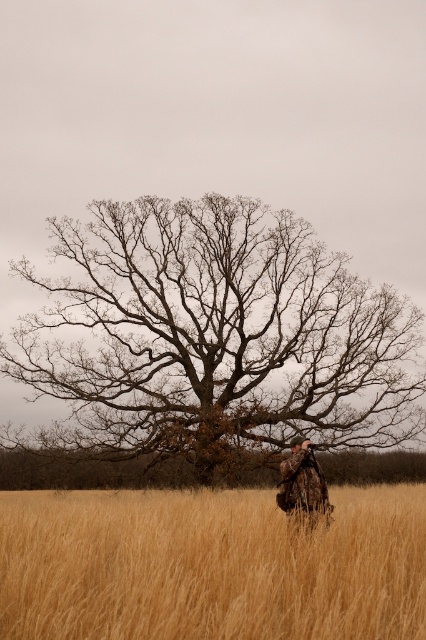
Question: Which of the following is the closest to the observer?

Choices:
 (A) (291, 509)
 (B) (140, 372)
 (C) (408, 564)

Answer: (C)

Question: Which object appears farthest from the camera in this image?

Choices:
 (A) golden grass at center
 (B) camouflage fabric at center

Answer: (B)

Question: Among these objects, which one is farthest from the camera?

Choices:
 (A) bare branches at center
 (B) camouflage fabric at center
 (C) golden grass at center

Answer: (A)

Question: Does bare branches at center have a lesser width compared to golden grass at center?

Choices:
 (A) no
 (B) yes

Answer: (A)

Question: Is golden grass at center bigger than camouflage fabric at center?

Choices:
 (A) no
 (B) yes

Answer: (B)

Question: Is bare branches at center to the left of camouflage fabric at center from the viewer's perspective?

Choices:
 (A) yes
 (B) no

Answer: (A)